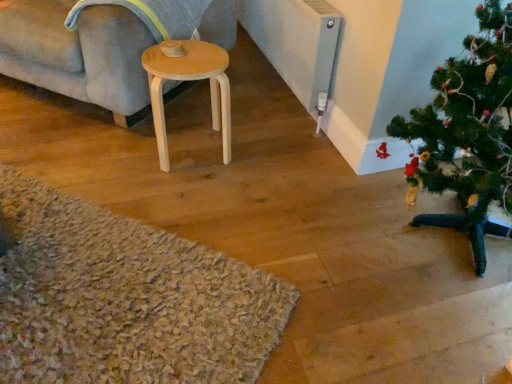
Identify the location of textured gray radiator at center right. (296, 43).

Measure the distance between point (x=309, y=31) and camera.

Point (x=309, y=31) and camera are 1.94 meters apart.

Describe the element at coordinates (189, 80) in the screenshot. This screenshot has width=512, height=384. I see `light wood stool at center` at that location.

In order to face green matte christmas tree at lower right, should I rotate leftwards or rightwards?

Rotate your view right by about 30.762°.

I want to click on light gray fabric couch at upper left, so click(78, 53).

Is light wood stool at center aimed at textured gray radiator at center right?

No, light wood stool at center is not turned towards textured gray radiator at center right.

Who is shorter, light wood stool at center or textured gray radiator at center right?

light wood stool at center.

Locate an element on the screen. The image size is (512, 384). radiator behind the light wood stool at center is located at coordinates tap(296, 43).

From the image's perspective, between green matte christmas tree at lower right and light wood stool at center, which one is located above?

light wood stool at center appears higher in the image.

Looking at this image, considering the positions of objects green matte christmas tree at lower right and light wood stool at center in the image provided, who is behind, green matte christmas tree at lower right or light wood stool at center?

Positioned behind is light wood stool at center.

Is green matte christmas tree at lower right inside the boundaries of light wood stool at center, or outside?

green matte christmas tree at lower right is not inside light wood stool at center, it's outside.

Does green matte christmas tree at lower right have a smaller size compared to light wood stool at center?

Actually, green matte christmas tree at lower right might be larger than light wood stool at center.

How far apart are light gray fabric couch at upper left and textured gray radiator at center right?

They are 38.10 inches apart.

From a real-world perspective, who is located higher, light gray fabric couch at upper left or textured gray radiator at center right?

From a 3D spatial view, light gray fabric couch at upper left is above.

From the image's perspective, does light gray fabric couch at upper left appear lower than textured gray radiator at center right?

No, from the image's perspective, light gray fabric couch at upper left is not beneath textured gray radiator at center right.

Considering the positions of objects light gray fabric couch at upper left and textured gray radiator at center right in the image provided, who is behind, light gray fabric couch at upper left or textured gray radiator at center right?

textured gray radiator at center right is further away from the camera.

Does textured gray radiator at center right have a greater height compared to light gray fabric couch at upper left?

In fact, textured gray radiator at center right may be shorter than light gray fabric couch at upper left.

Based on the photo, is textured gray radiator at center right inside or outside of light gray fabric couch at upper left?

textured gray radiator at center right exists outside the volume of light gray fabric couch at upper left.

From the image's perspective, is textured gray radiator at center right above or below light gray fabric couch at upper left?

Based on their image positions, textured gray radiator at center right is located beneath light gray fabric couch at upper left.

Is textured gray radiator at center right wider or thinner than light gray fabric couch at upper left?

In the image, textured gray radiator at center right appears to be more narrow than light gray fabric couch at upper left.

Are light wood stool at center and light gray fabric couch at upper left beside each other?

There is a gap between light wood stool at center and light gray fabric couch at upper left.

Considering the relative positions of light wood stool at center and light gray fabric couch at upper left in the image provided, is light wood stool at center to the right of light gray fabric couch at upper left from the viewer's perspective?

Yes, light wood stool at center is to the right of light gray fabric couch at upper left.

Can textured gray radiator at center right be found inside green matte christmas tree at lower right?

No.

Which point is more distant from viewer, (486, 140) or (325, 80)?

The point (325, 80) is farther.

Which of these two, green matte christmas tree at lower right or textured gray radiator at center right, stands shorter?

With less height is textured gray radiator at center right.

Is light wood stool at center located outside green matte christmas tree at lower right?

Yes, light wood stool at center is outside of green matte christmas tree at lower right.

Considering the sizes of light wood stool at center and green matte christmas tree at lower right in the image, is light wood stool at center wider or thinner than green matte christmas tree at lower right?

Considering their sizes, light wood stool at center looks slimmer than green matte christmas tree at lower right.

Are light wood stool at center and green matte christmas tree at lower right beside each other?

No, light wood stool at center is not with green matte christmas tree at lower right.

Is light wood stool at center taller or shorter than green matte christmas tree at lower right?

Considering their sizes, light wood stool at center has less height than green matte christmas tree at lower right.

The image size is (512, 384). Identify the location of radiator that is on the right side of light wood stool at center. (296, 43).

At what (x,y) coordinates should I click in order to perform the action: click on christmas tree in front of the light wood stool at center. Please return your answer as a coordinate pair (x, y). Looking at the image, I should click on (468, 131).

When comparing their distances from light gray fabric couch at upper left, does light wood stool at center or green matte christmas tree at lower right seem closer?

light wood stool at center is closer to light gray fabric couch at upper left.

Which object lies further to the anchor point green matte christmas tree at lower right, light wood stool at center or light gray fabric couch at upper left?

light gray fabric couch at upper left is positioned further to the anchor green matte christmas tree at lower right.

When comparing their distances from light gray fabric couch at upper left, does light wood stool at center or textured gray radiator at center right seem further?

textured gray radiator at center right lies further to light gray fabric couch at upper left than the other object.

When comparing their distances from green matte christmas tree at lower right, does light gray fabric couch at upper left or textured gray radiator at center right seem closer?

textured gray radiator at center right.

From the image, which object appears to be farther from light wood stool at center, green matte christmas tree at lower right or light gray fabric couch at upper left?

The object further to light wood stool at center is green matte christmas tree at lower right.

When comparing their distances from light gray fabric couch at upper left, does green matte christmas tree at lower right or textured gray radiator at center right seem further?

green matte christmas tree at lower right lies further to light gray fabric couch at upper left than the other object.

Which object lies nearer to the anchor point green matte christmas tree at lower right, textured gray radiator at center right or light wood stool at center?

textured gray radiator at center right is closer to green matte christmas tree at lower right.

Based on their spatial positions, is green matte christmas tree at lower right or light wood stool at center closer to textured gray radiator at center right?

light wood stool at center.

You are a GUI agent. You are given a task and a screenshot of the screen. Output one action in this format:
    pyautogui.click(x=<x>, y=<y>)
    Task: Click on the radiator situated between light wood stool at center and green matte christmas tree at lower right from left to right
    Image resolution: width=512 pixels, height=384 pixels.
    Given the screenshot: What is the action you would take?
    pyautogui.click(x=296, y=43)

Locate an element on the screen. stool situated between light gray fabric couch at upper left and green matte christmas tree at lower right from left to right is located at coordinates (189, 80).

You are a GUI agent. You are given a task and a screenshot of the screen. Output one action in this format:
    pyautogui.click(x=<x>, y=<y>)
    Task: Click on the radiator between light gray fabric couch at upper left and green matte christmas tree at lower right in the horizontal direction
    
    Given the screenshot: What is the action you would take?
    pyautogui.click(x=296, y=43)

Locate an element on the screen. This screenshot has width=512, height=384. stool between light gray fabric couch at upper left and textured gray radiator at center right is located at coordinates (189, 80).